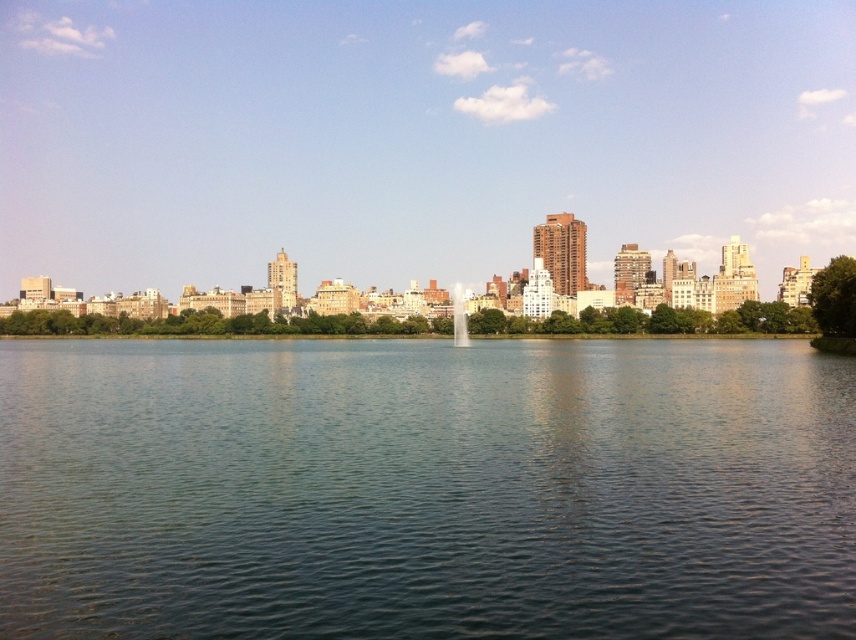
Measure the distance from clear water at center to transparent glass fountain at center.

The distance of clear water at center from transparent glass fountain at center is 87.46 meters.

Which is above, clear water at center or transparent glass fountain at center?

transparent glass fountain at center is above.

The image size is (856, 640). Find the location of `clear water at center`. clear water at center is located at coordinates 425,488.